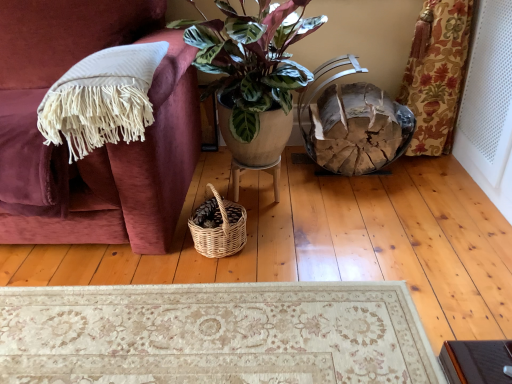
Question: From the image's perspective, would you say white perforated screen door at right is shown under woven natural picnic basket at lower center?

Choices:
 (A) yes
 (B) no

Answer: (B)

Question: Can you confirm if white perforated screen door at right is smaller than woven natural picnic basket at lower center?

Choices:
 (A) yes
 (B) no

Answer: (B)

Question: Considering the relative sizes of white perforated screen door at right and woven natural picnic basket at lower center in the image provided, is white perforated screen door at right bigger than woven natural picnic basket at lower center?

Choices:
 (A) no
 (B) yes

Answer: (B)

Question: Considering the relative sizes of white perforated screen door at right and woven natural picnic basket at lower center in the image provided, is white perforated screen door at right shorter than woven natural picnic basket at lower center?

Choices:
 (A) yes
 (B) no

Answer: (B)

Question: From the image's perspective, does white perforated screen door at right appear higher than woven natural picnic basket at lower center?

Choices:
 (A) yes
 (B) no

Answer: (A)

Question: Visually, is white perforated screen door at right positioned to the left or to the right of woven natural picnic basket at lower center?

Choices:
 (A) right
 (B) left

Answer: (A)

Question: In terms of height, does white perforated screen door at right look taller or shorter compared to woven natural picnic basket at lower center?

Choices:
 (A) tall
 (B) short

Answer: (A)

Question: Is white perforated screen door at right inside or outside of woven natural picnic basket at lower center?

Choices:
 (A) inside
 (B) outside

Answer: (B)

Question: From a real-world perspective, is white perforated screen door at right above or below woven natural picnic basket at lower center?

Choices:
 (A) below
 (B) above

Answer: (B)

Question: Considering the relative positions of green glossy plant pot at center and woven natural picnic basket at lower center in the image provided, is green glossy plant pot at center to the left or to the right of woven natural picnic basket at lower center?

Choices:
 (A) right
 (B) left

Answer: (A)

Question: Considering the positions of green glossy plant pot at center and woven natural picnic basket at lower center in the image, is green glossy plant pot at center taller or shorter than woven natural picnic basket at lower center?

Choices:
 (A) short
 (B) tall

Answer: (B)

Question: Does point coord(307,81) appear closer or farther from the camera than point coord(204,238)?

Choices:
 (A) closer
 (B) farther

Answer: (B)

Question: From a real-world perspective, is green glossy plant pot at center above or below woven natural picnic basket at lower center?

Choices:
 (A) below
 (B) above

Answer: (B)

Question: Is point (219, 243) closer or farther from the camera than point (109, 100)?

Choices:
 (A) farther
 (B) closer

Answer: (A)

Question: Choose the correct answer: Is woven natural picnic basket at lower center inside white fringed blanket at left or outside it?

Choices:
 (A) outside
 (B) inside

Answer: (A)